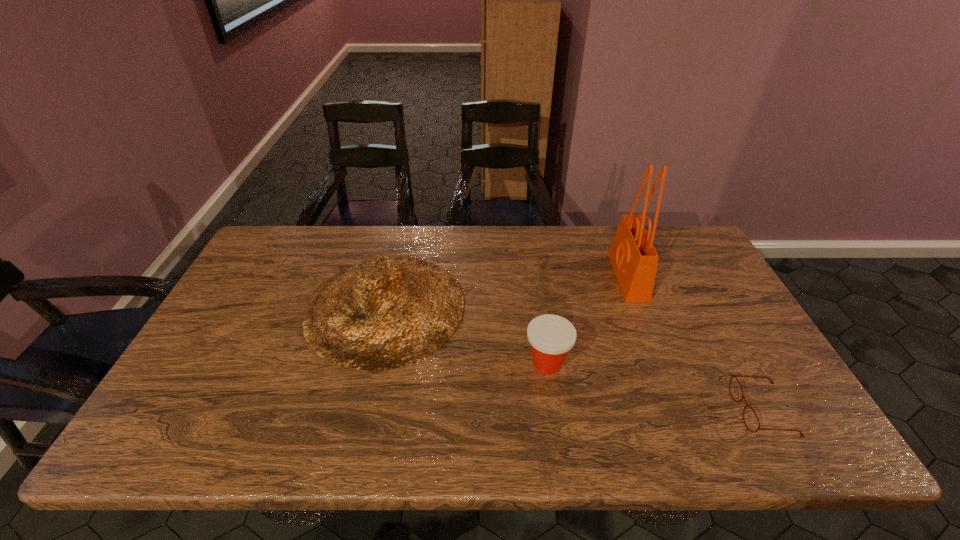
The height and width of the screenshot is (540, 960). I want to click on object located in the near right corner section of the desktop, so click(x=732, y=376).

Identify the location of free space at the far edge of the desktop. (584, 226).

This screenshot has width=960, height=540. What are the coordinates of `blank space at the near edge of the desktop` in the screenshot? It's located at (708, 434).

This screenshot has height=540, width=960. I want to click on free space at the left edge, so click(167, 406).

The height and width of the screenshot is (540, 960). What are the coordinates of `vacant area at the far left corner` in the screenshot? It's located at (294, 242).

In the image, there is a desktop. Find the location of `free space at the far right corner`. free space at the far right corner is located at coordinates (686, 261).

This screenshot has width=960, height=540. I want to click on vacant space at the near right corner, so click(x=794, y=423).

Identify the location of vacant region between the tallest object and the Dixie cup. The height and width of the screenshot is (540, 960). (588, 320).

At what (x,y) coordinates should I click in order to perform the action: click on vacant area that lies between the nearest object and the second object from left to right. Please return your answer as a coordinate pair (x, y). This screenshot has width=960, height=540. Looking at the image, I should click on (655, 387).

In order to click on vacant area that lies between the nearest object and the third shortest object in this screenshot , I will do `click(574, 359)`.